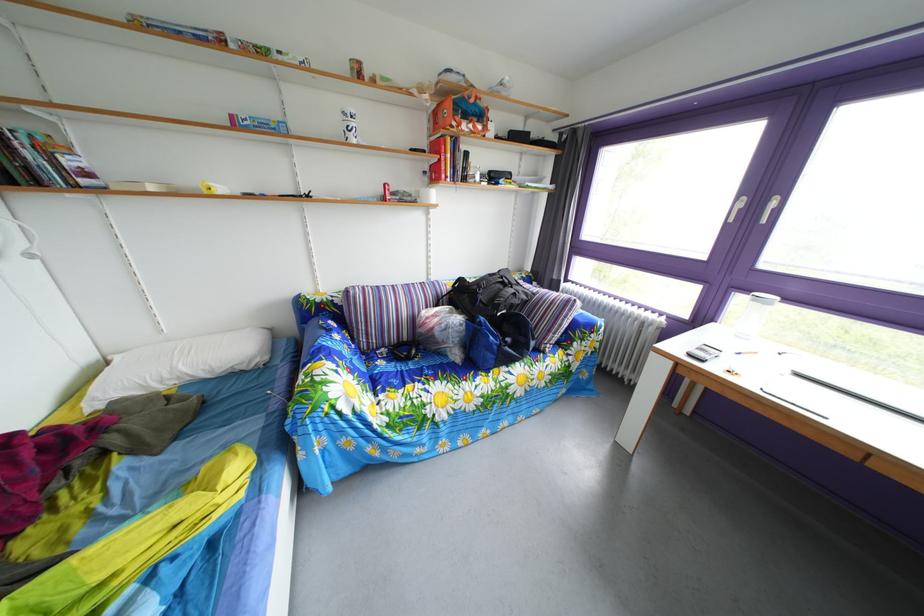
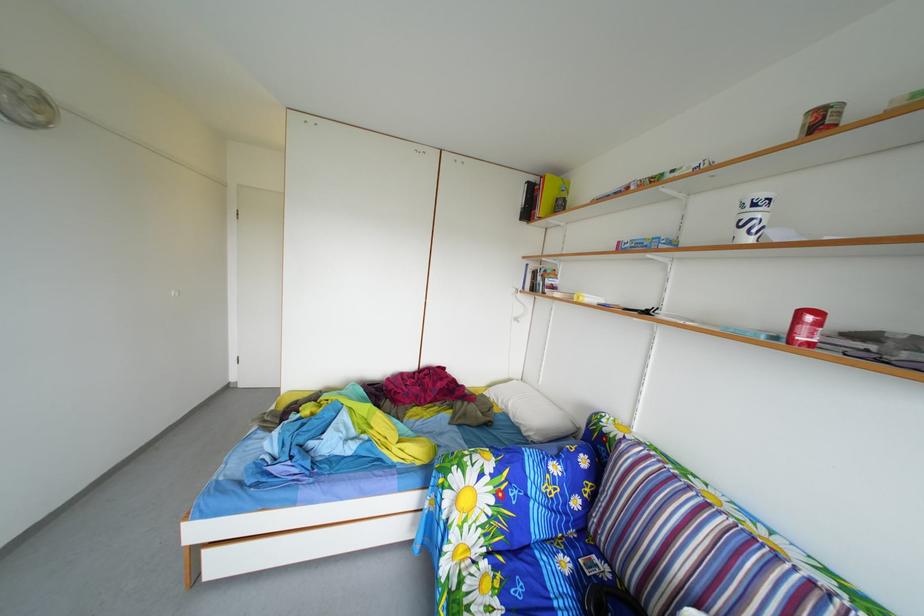
The point at [349,421] is marked in the first image. Where is the corresponding point in the second image?

(453, 507)